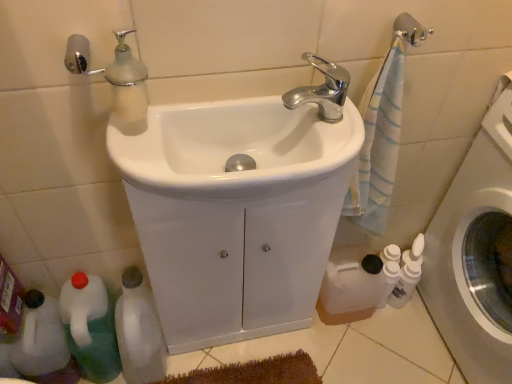
Locate an element on the screen. unoccupied area in front of chrome metallic faucet at upper center is located at coordinates (307, 161).